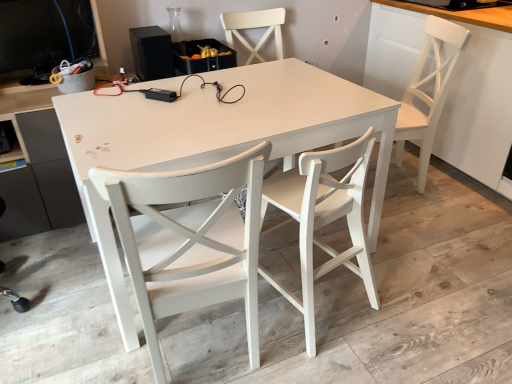
Question: Do you think white wood chair at center, the 2th chair from the left, is within black matte speaker at upper left, or outside of it?

Choices:
 (A) inside
 (B) outside

Answer: (B)

Question: Looking at their shapes, would you say white wood chair at center, the second chair positioned from the right, is wider or thinner than black matte speaker at upper left?

Choices:
 (A) thin
 (B) wide

Answer: (B)

Question: Which object is positioned closest to the white wood chair at right, positioned as the third chair in left-to-right order?

Choices:
 (A) white painted wood chair at center, placed as the first chair when sorted from left to right
 (B) black matte speaker at upper left
 (C) matte black desktop computer at upper left
 (D) white matte table at center
 (E) white wood chair at center, the 2th chair from the left

Answer: (E)

Question: Estimate the real-world distances between objects in this image. Which object is farther from the white wood chair at right, the 1th chair from the right?

Choices:
 (A) white wood chair at center, the second chair positioned from the right
 (B) black matte speaker at upper left
 (C) matte black desktop computer at upper left
 (D) white painted wood chair at center, which ranks as the 3th chair in right-to-left order
 (E) white matte table at center

Answer: (C)